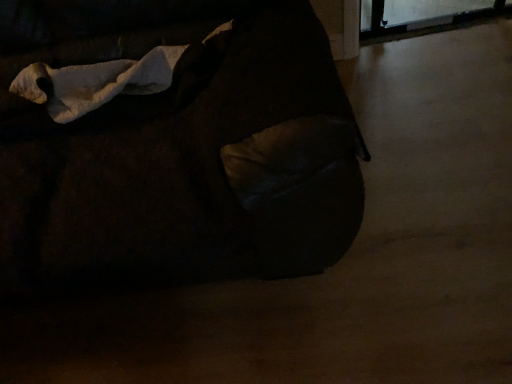
Find the location of a particular element. free space above dark fabric bean bag at center (from a real-world perspective) is located at coordinates (376, 206).